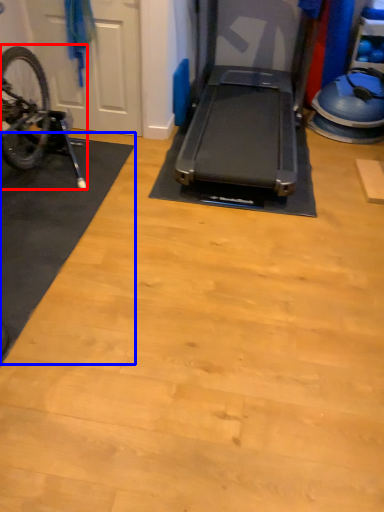
Question: Which of the following is the closest to the observer, bicycle (highlighted by a red box) or mat (highlighted by a blue box)?

Choices:
 (A) bicycle
 (B) mat

Answer: (B)